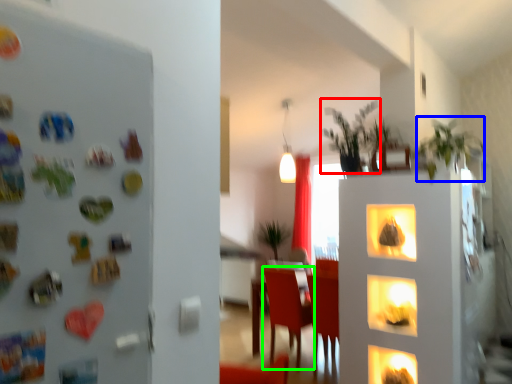
Question: Which object is positioned farthest from plant (highlighted by a red box)? Select from plant (highlighted by a blue box) and armchair (highlighted by a green box).

Choices:
 (A) plant
 (B) armchair

Answer: (B)